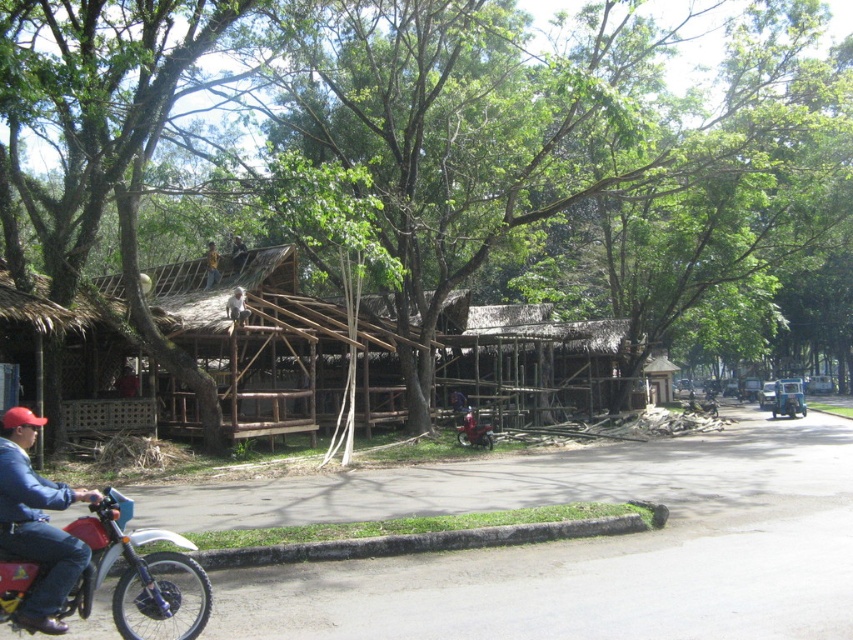
Question: Which point is farther from the camera taking this photo?

Choices:
 (A) (242, 301)
 (B) (421, 429)
 (C) (13, 576)

Answer: (B)

Question: Which object is closer to the camera taking this photo?

Choices:
 (A) gray fur monkey at upper center
 (B) thatched bamboo hut at center
 (C) red matte motorcycle at lower left
 (D) green leafy tree at center

Answer: (C)

Question: Can you confirm if thatched bamboo hut at center is positioned above red matte motorcycle at lower left?

Choices:
 (A) no
 (B) yes

Answer: (B)

Question: Which point is farther from the camera taking this photo?

Choices:
 (A) (485, 440)
 (B) (207, 250)
 (C) (317, 266)
 (D) (238, 252)

Answer: (C)

Question: Can you confirm if thatched bamboo hut at center is positioned to the left of red matte motorcycle at center?

Choices:
 (A) no
 (B) yes

Answer: (A)

Question: Can you confirm if thatched bamboo hut at center is positioned to the left of red matte motorcycle at lower left?

Choices:
 (A) yes
 (B) no

Answer: (B)